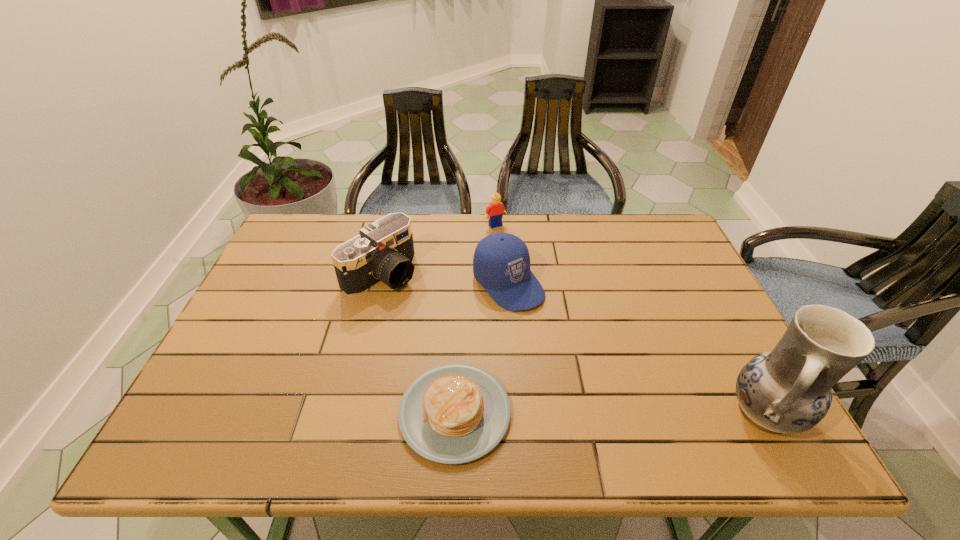
This screenshot has height=540, width=960. What are the coordinates of `the shortest object` in the screenshot? It's located at pos(456,413).

Where is `the rightmost object`? Image resolution: width=960 pixels, height=540 pixels. the rightmost object is located at coordinates (788, 390).

The image size is (960, 540). Identify the location of pottery. (788, 390).

Where is `camera`? The width and height of the screenshot is (960, 540). camera is located at coordinates (383, 252).

Where is `cap`? The height and width of the screenshot is (540, 960). cap is located at coordinates (501, 263).

Image resolution: width=960 pixels, height=540 pixels. Identify the location of Lego. (496, 208).

At what (x,y) coordinates should I click in order to perform the action: click on vacant space situated on the back of the pancake. Please return your answer as a coordinate pair (x, y). The image size is (960, 540). Looking at the image, I should click on (461, 283).

Locate an element on the screen. Image resolution: width=960 pixels, height=540 pixels. vacant space located on the back of the rightmost object is located at coordinates (699, 289).

In order to click on blank area located on the front-facing side of the camera in this screenshot , I will do `click(465, 332)`.

Locate an element on the screen. free location located on the front-facing side of the camera is located at coordinates (514, 367).